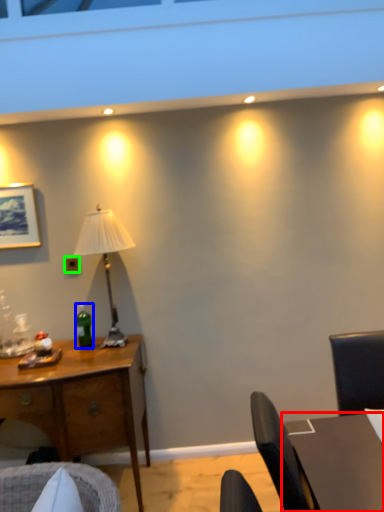
Question: Considering the real-world distances, which object is farthest from table (highlighted by a red box)? bottle (highlighted by a blue box) or power outlet (highlighted by a green box)?

Choices:
 (A) bottle
 (B) power outlet

Answer: (B)